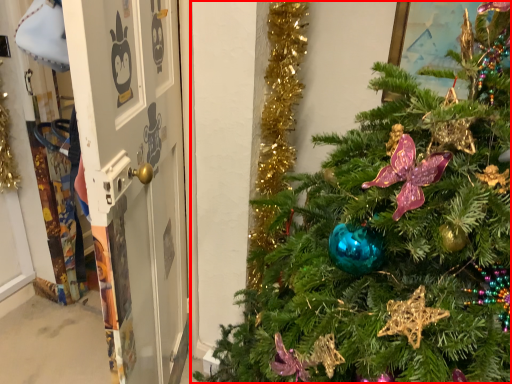
Question: From the image, what is the correct spatial relationship of christmas tree (annotated by the red box) in relation to screen door?

Choices:
 (A) right
 (B) left

Answer: (A)